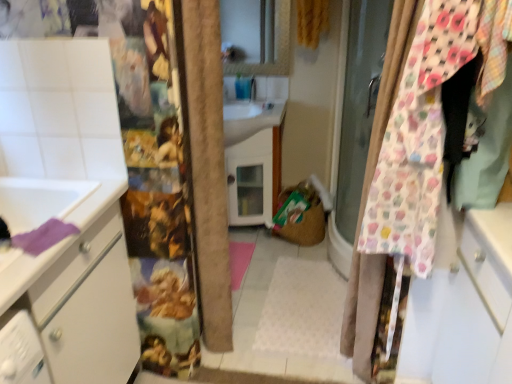
The width and height of the screenshot is (512, 384). Identify the location of yellow textured curtain at upper center, the 2th curtain from the bottom. (311, 21).

Which is behind, yellow textured curtain at upper center, the 2th curtain from the bottom, or white glossy sink at center?

white glossy sink at center is more distant.

Could you tell me if yellow textured curtain at upper center, the 1th curtain when ordered from top to bottom, is facing white glossy sink at center?

No.

Which is in front, point (313, 32) or point (269, 90)?

The point (313, 32) is closer to the camera.

Is yellow textured curtain at upper center, the first curtain viewed from the back, wider than white glossy sink at center?

Incorrect, the width of yellow textured curtain at upper center, the first curtain viewed from the back, does not surpass that of white glossy sink at center.

Consider the image. Considering the relative sizes of floral fabric curtain at right, marked as the second curtain in a top-to-bottom arrangement, and yellow textured curtain at upper center, the first curtain viewed from the back, in the image provided, is floral fabric curtain at right, marked as the second curtain in a top-to-bottom arrangement, thinner than yellow textured curtain at upper center, the first curtain viewed from the back,?

Yes, floral fabric curtain at right, marked as the second curtain in a top-to-bottom arrangement, is thinner than yellow textured curtain at upper center, the first curtain viewed from the back.

Is floral fabric curtain at right, placed as the first curtain when sorted from bottom to top, looking in the opposite direction of yellow textured curtain at upper center, which appears as the 2th curtain when viewed from the front?

No, yellow textured curtain at upper center, which appears as the 2th curtain when viewed from the front, is not at the back of floral fabric curtain at right, placed as the first curtain when sorted from bottom to top.

Relative to yellow textured curtain at upper center, the first curtain viewed from the back, is floral fabric curtain at right, the second curtain when ordered from back to front, in front or behind?

Visually, floral fabric curtain at right, the second curtain when ordered from back to front, is located in front of yellow textured curtain at upper center, the first curtain viewed from the back.

Locate an element on the screen. The width and height of the screenshot is (512, 384). curtain lying behind the floral fabric curtain at right, placed as the first curtain when sorted from bottom to top is located at coordinates (311, 21).

You are a GUI agent. You are given a task and a screenshot of the screen. Output one action in this format:
    pyautogui.click(x=<x>, y=<y>)
    Task: Click on the curtain that is in front of the yellow textured curtain at upper center, the 1th curtain when ordered from top to bottom
    The image size is (512, 384).
    Given the screenshot: What is the action you would take?
    pyautogui.click(x=370, y=191)

Is yellow textured curtain at upper center, which appears as the 2th curtain when viewed from the front, looking in the opposite direction of floral fabric curtain at right, the second curtain when ordered from back to front?

No, yellow textured curtain at upper center, which appears as the 2th curtain when viewed from the front, is not facing the opposite direction of floral fabric curtain at right, the second curtain when ordered from back to front.

Which of these two, yellow textured curtain at upper center, the 2th curtain from the bottom, or floral fabric curtain at right, marked as the second curtain in a top-to-bottom arrangement, is smaller?

yellow textured curtain at upper center, the 2th curtain from the bottom.

Is white glossy sink at center behind yellow textured curtain at upper center, which appears as the 2th curtain when viewed from the front?

Yes, white glossy sink at center is behind yellow textured curtain at upper center, which appears as the 2th curtain when viewed from the front.

Based on the photo, does white glossy sink at center have a lesser height compared to yellow textured curtain at upper center, which appears as the 2th curtain when viewed from the front?

Incorrect, the height of white glossy sink at center does not fall short of that of yellow textured curtain at upper center, which appears as the 2th curtain when viewed from the front.

Which of these two, white glossy sink at center or yellow textured curtain at upper center, the 1th curtain when ordered from top to bottom, is wider?

white glossy sink at center.

Image resolution: width=512 pixels, height=384 pixels. What are the coordinates of `sink behind the floral fabric curtain at right, marked as the second curtain in a top-to-bottom arrangement` in the screenshot? It's located at (253, 108).

Could you measure the distance between floral fabric curtain at right, the second curtain when ordered from back to front, and white glossy sink at center?

floral fabric curtain at right, the second curtain when ordered from back to front, and white glossy sink at center are 1.34 meters apart.

Considering the relative sizes of floral fabric curtain at right, the first curtain from the front, and white glossy sink at center in the image provided, is floral fabric curtain at right, the first curtain from the front, smaller than white glossy sink at center?

Incorrect, floral fabric curtain at right, the first curtain from the front, is not smaller in size than white glossy sink at center.

From the image's perspective, which is above, floral fabric curtain at right, placed as the first curtain when sorted from bottom to top, or white glossy sink at center?

white glossy sink at center.

Can you confirm if white glossy sink at center is wider than floral fabric curtain at right, marked as the second curtain in a top-to-bottom arrangement?

Yes.

Does white glossy sink at center have a lesser height compared to floral fabric curtain at right, the first curtain from the front?

Yes.

From the image's perspective, between white glossy sink at center and floral fabric curtain at right, marked as the second curtain in a top-to-bottom arrangement, who is located below?

floral fabric curtain at right, marked as the second curtain in a top-to-bottom arrangement, from the image's perspective.

Where is `sink that is below the yellow textured curtain at upper center, the 1th curtain when ordered from top to bottom (from the image's perspective)`? sink that is below the yellow textured curtain at upper center, the 1th curtain when ordered from top to bottom (from the image's perspective) is located at coordinates (253, 108).

At what (x,y) coordinates should I click in order to perform the action: click on curtain that appears on the right of yellow textured curtain at upper center, the 1th curtain when ordered from top to bottom. Please return your answer as a coordinate pair (x, y). The height and width of the screenshot is (384, 512). Looking at the image, I should click on (370, 191).

From the image, which object appears to be nearer to white glossy sink at center, yellow textured curtain at upper center, the first curtain viewed from the back, or floral fabric curtain at right, placed as the first curtain when sorted from bottom to top?

yellow textured curtain at upper center, the first curtain viewed from the back, is positioned closer to the anchor white glossy sink at center.

When comparing their distances from yellow textured curtain at upper center, which appears as the 2th curtain when viewed from the front, does white glossy sink at center or floral fabric curtain at right, marked as the second curtain in a top-to-bottom arrangement, seem further?

floral fabric curtain at right, marked as the second curtain in a top-to-bottom arrangement.

Based on the photo, based on their spatial positions, is floral fabric curtain at right, marked as the second curtain in a top-to-bottom arrangement, or yellow textured curtain at upper center, the 2th curtain from the bottom, further from white glossy sink at center?

floral fabric curtain at right, marked as the second curtain in a top-to-bottom arrangement, lies further to white glossy sink at center than the other object.

Which object lies further to the anchor point yellow textured curtain at upper center, which appears as the 2th curtain when viewed from the front, floral fabric curtain at right, the second curtain when ordered from back to front, or white glossy sink at center?

floral fabric curtain at right, the second curtain when ordered from back to front, is further to yellow textured curtain at upper center, which appears as the 2th curtain when viewed from the front.

Considering their positions, is white glossy sink at center positioned closer to floral fabric curtain at right, the second curtain when ordered from back to front, than yellow textured curtain at upper center, the 2th curtain from the bottom?

The object closer to floral fabric curtain at right, the second curtain when ordered from back to front, is white glossy sink at center.

Considering their positions, is yellow textured curtain at upper center, the first curtain viewed from the back, positioned further to floral fabric curtain at right, the first curtain from the front, than white glossy sink at center?

yellow textured curtain at upper center, the first curtain viewed from the back.

This screenshot has width=512, height=384. Find the location of `curtain between floral fabric curtain at right, placed as the first curtain when sorted from bottom to top, and white glossy sink at center, along the z-axis`. curtain between floral fabric curtain at right, placed as the first curtain when sorted from bottom to top, and white glossy sink at center, along the z-axis is located at coordinates (311, 21).